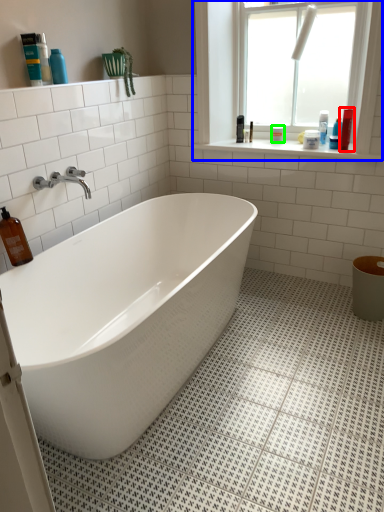
Question: Which object is positioned closest to cleaning product (highlighted by a red box)? Select from window (highlighted by a blue box) and toiletry (highlighted by a green box).

Choices:
 (A) window
 (B) toiletry

Answer: (B)